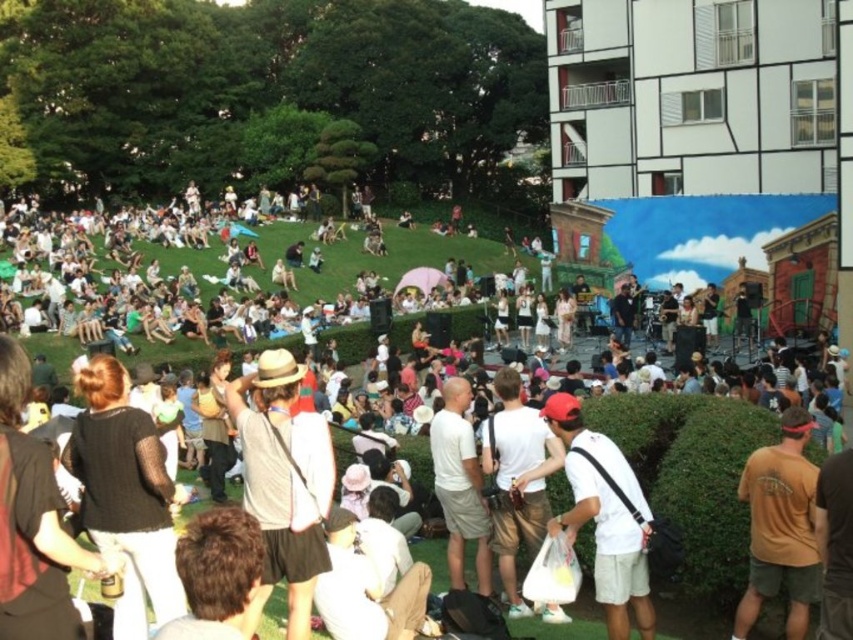
You are a photographer at the event and want to capture a photo of the white cotton shirt at center. If your camera has a focal length of 50mm and you are positioned 3 meters away from the shirt, will the shirt be in the center of the photo?

The white cotton shirt at center is located at the center point of the image, so yes, it will be in the center of the photo.

You are a photographer trying to capture a clear shot of the white cotton shirt at center and the white matte baseball cap at center. Based on their sizes, which object should you focus on to ensure it fits entirely within your camera frame?

The white cotton shirt at center might be wider than the white matte baseball cap at center, so you should focus on the white cotton shirt at center to ensure it fits within the frame since it is potentially larger.